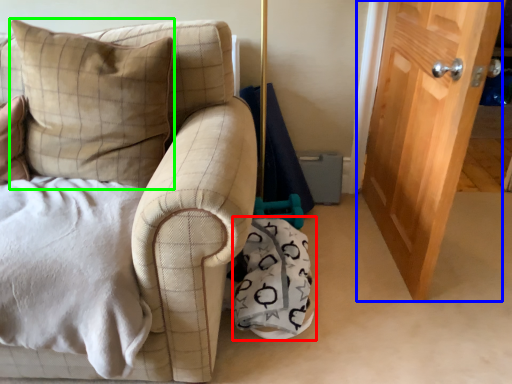
Question: Estimate the real-world distances between objects in this image. Which object is closer to material (highlighted by a red box), door (highlighted by a blue box) or pillow (highlighted by a green box)?

Choices:
 (A) door
 (B) pillow

Answer: (A)